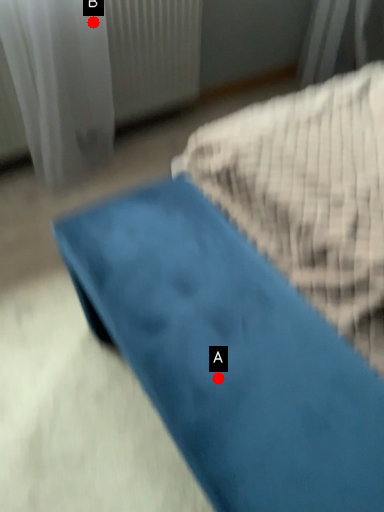
Question: Two points are circled on the image, labeled by A and B beside each circle. Which of the following is the farthest from the observer?

Choices:
 (A) A is further
 (B) B is further

Answer: (B)